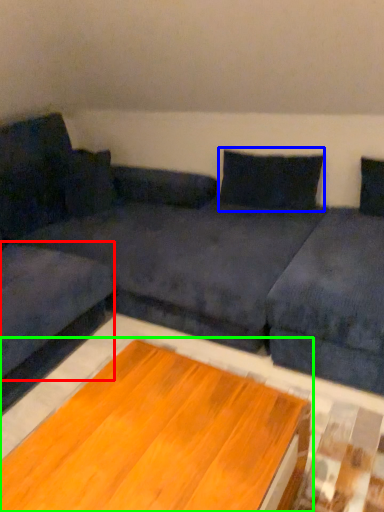
Question: Considering the real-world distances, which object is farthest from couch (highlighted by a red box)? pillow (highlighted by a blue box) or table (highlighted by a green box)?

Choices:
 (A) pillow
 (B) table

Answer: (A)